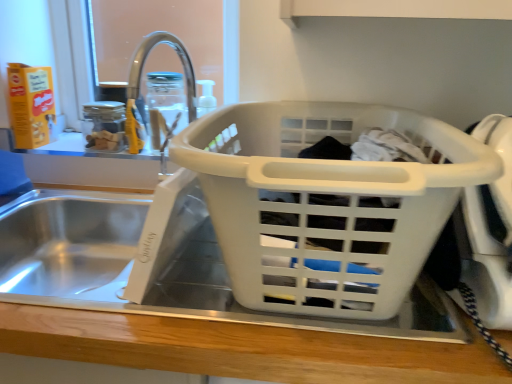
Question: Is white plastic laundry basket at center wider than transparent glass jar at upper center?

Choices:
 (A) no
 (B) yes

Answer: (B)

Question: Is white plastic laundry basket at center touching transparent glass jar at upper center?

Choices:
 (A) yes
 (B) no

Answer: (B)

Question: Does white plastic laundry basket at center have a greater height compared to transparent glass jar at upper center?

Choices:
 (A) yes
 (B) no

Answer: (A)

Question: Could transparent glass jar at upper center be considered to be inside white plastic laundry basket at center?

Choices:
 (A) yes
 (B) no

Answer: (B)

Question: From a real-world perspective, does white plastic laundry basket at center sit lower than transparent glass jar at upper center?

Choices:
 (A) yes
 (B) no

Answer: (A)

Question: From the image's perspective, is white plastic laundry basket at center under transparent glass jar at upper center?

Choices:
 (A) no
 (B) yes

Answer: (B)

Question: Considering the relative sizes of transparent glass jar at upper center and white plastic laundry basket at center in the image provided, is transparent glass jar at upper center smaller than white plastic laundry basket at center?

Choices:
 (A) no
 (B) yes

Answer: (B)

Question: From the image's perspective, is transparent glass jar at upper center on white plastic laundry basket at center?

Choices:
 (A) yes
 (B) no

Answer: (A)

Question: Considering the relative sizes of transparent glass jar at upper center and white plastic laundry basket at center in the image provided, is transparent glass jar at upper center taller than white plastic laundry basket at center?

Choices:
 (A) yes
 (B) no

Answer: (B)

Question: From a real-world perspective, does transparent glass jar at upper center stand above white plastic laundry basket at center?

Choices:
 (A) yes
 (B) no

Answer: (A)

Question: Is transparent glass jar at upper center far from white plastic laundry basket at center?

Choices:
 (A) no
 (B) yes

Answer: (A)

Question: Could white plastic laundry basket at center be considered to be inside transparent glass jar at upper center?

Choices:
 (A) no
 (B) yes

Answer: (A)

Question: In terms of size, does white plastic laundry basket at center appear bigger or smaller than transparent glass jar at upper center?

Choices:
 (A) small
 (B) big

Answer: (B)